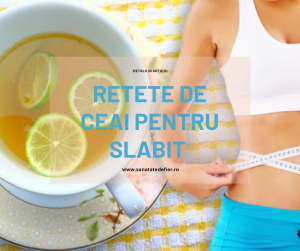
Image resolution: width=300 pixels, height=251 pixels. I want to click on white teacup, so click(92, 176).